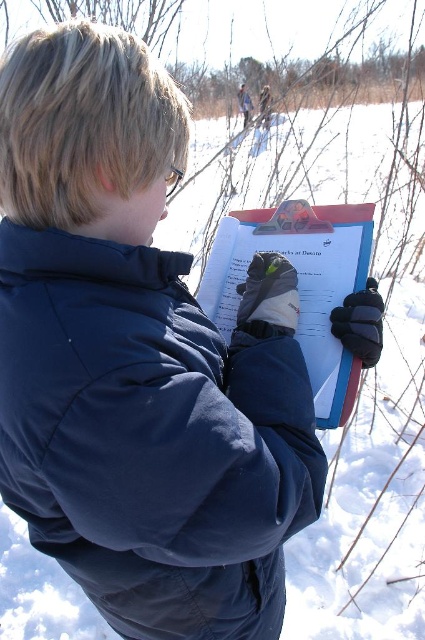
Question: Does navy blue puffy jacket at center appear over matte plastic clipboard at center?

Choices:
 (A) yes
 (B) no

Answer: (B)

Question: Among these objects, which one is nearest to the camera?

Choices:
 (A) navy blue puffy jacket at center
 (B) matte plastic clipboard at center

Answer: (A)

Question: Which object is farther from the camera taking this photo?

Choices:
 (A) matte plastic clipboard at center
 (B) navy blue puffy jacket at center

Answer: (A)

Question: Can you confirm if navy blue puffy jacket at center is positioned above matte plastic clipboard at center?

Choices:
 (A) yes
 (B) no

Answer: (B)

Question: Which point is farther to the camera?

Choices:
 (A) matte plastic clipboard at center
 (B) navy blue puffy jacket at center

Answer: (A)

Question: Can you confirm if navy blue puffy jacket at center is positioned to the left of matte plastic clipboard at center?

Choices:
 (A) yes
 (B) no

Answer: (A)